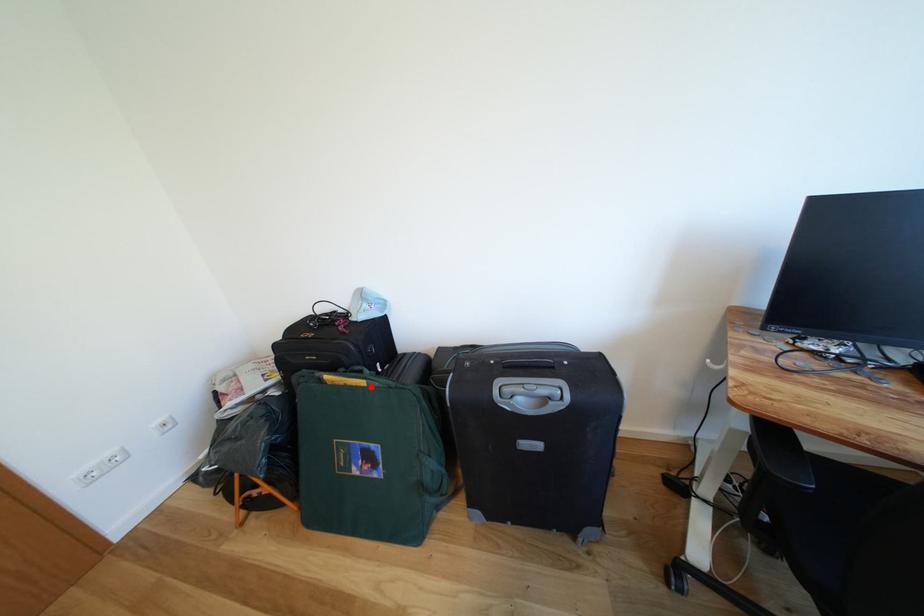
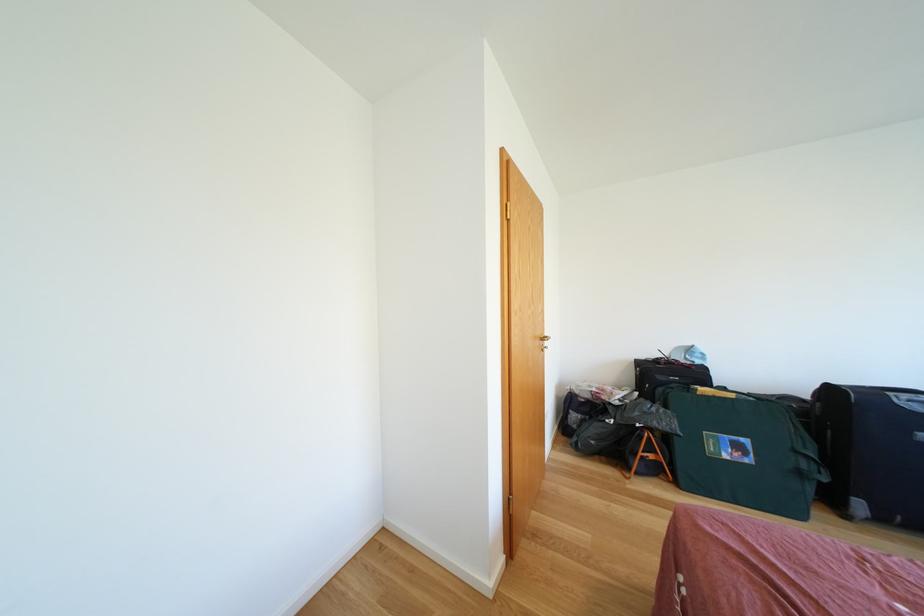
Question: I am providing you with two images of the same scene from different viewpoints. A red point is shown in image1. For the corresponding object point in image2, is it positioned nearer or farther from the camera?

Choices:
 (A) Nearer
 (B) Farther

Answer: (B)